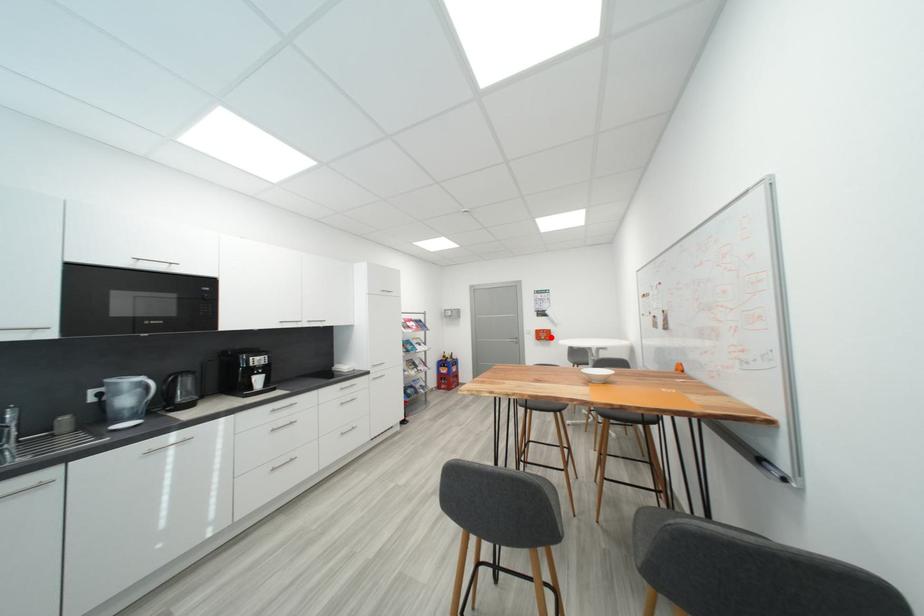
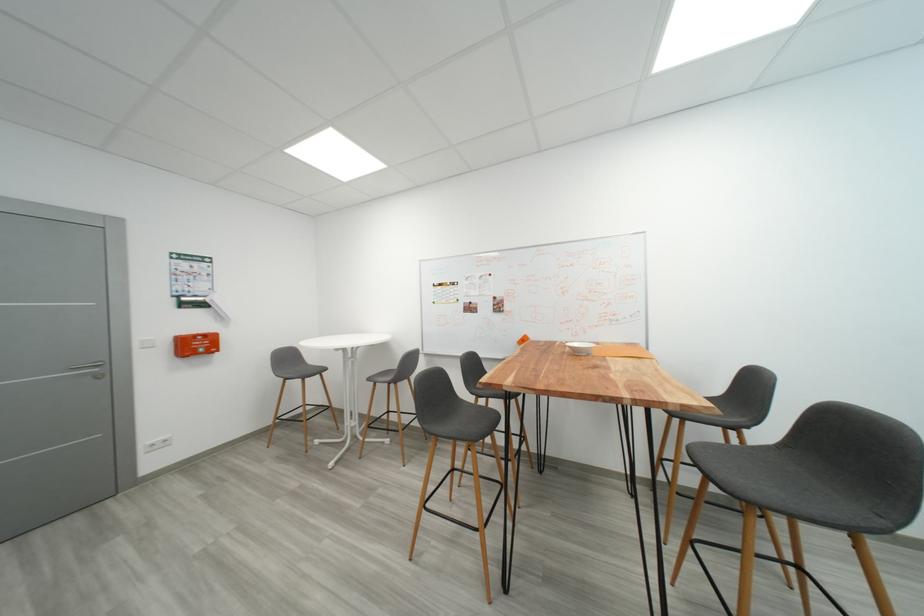
Question: A red point is marked in image1. In image2, is the corresponding 3D point closer to the camera or farther? Reply with the corresponding letter.

Choices:
 (A) The corresponding 3D point is closer.
 (B) The corresponding 3D point is farther.

Answer: (A)